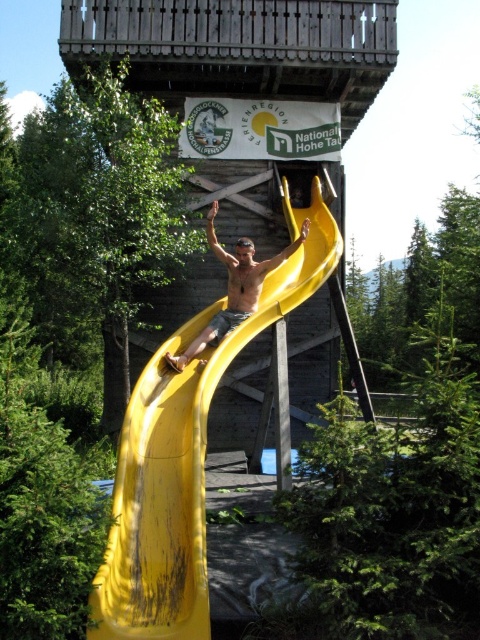
You are planning to install a new safety net for the yellow rubber slide at center and the wooden at center. Based on their positions, which object should the safety net be placed closer to?

The safety net should be placed closer to the yellow rubber slide at center since it is positioned on the right side of the wooden at center, ensuring coverage over the slide where the man is sliding down.

You are planning to place a small decorative flag on the wooden at center that is thinner than the matte yellow slide at center. Which object should you choose to place the flag on if you want it to be more visible from the ground?

You should place the flag on the matte yellow slide at center because it is wider than the wooden at center, making it more visible from the ground.